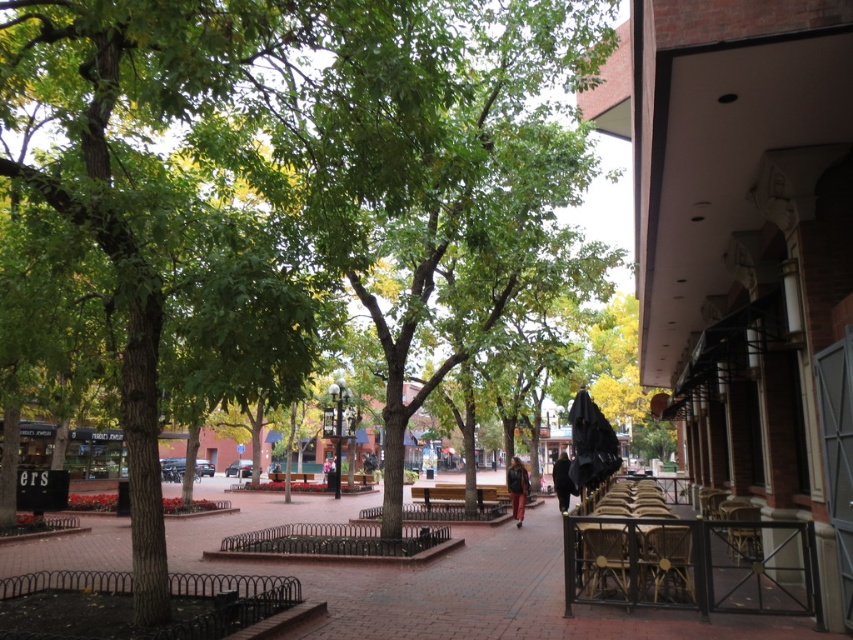
Question: Can you confirm if rattan chair at lower right is positioned above matte black jacket at center?

Choices:
 (A) no
 (B) yes

Answer: (B)

Question: Estimate the real-world distances between objects in this image. Which object is closer to the matte black jacket at center?

Choices:
 (A) wooden chair at right
 (B) brick pavement at center

Answer: (A)

Question: Does wooden chair at lower right have a larger size compared to wooden chair at right?

Choices:
 (A) no
 (B) yes

Answer: (A)

Question: Which of the following is the closest to the observer?

Choices:
 (A) wooden chair at lower right
 (B) rattan chair at lower right

Answer: (B)

Question: Which object is farther from the camera taking this photo?

Choices:
 (A) brick pavement at center
 (B) matte black jacket at center
 (C) rattan chair at lower right

Answer: (B)

Question: From the image, what is the correct spatial relationship of wooden chair at right in relation to matte black jacket at center?

Choices:
 (A) below
 (B) above

Answer: (B)